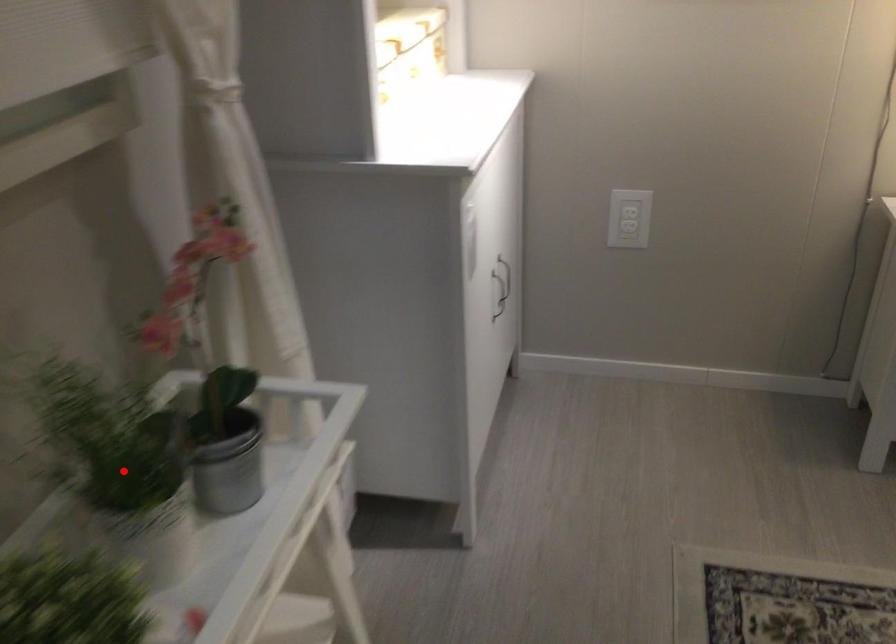
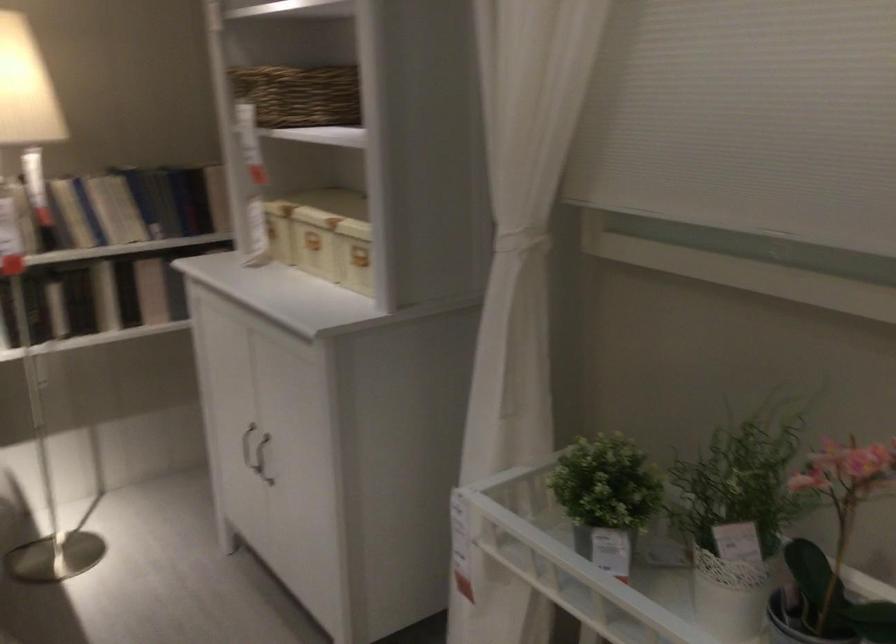
In the second image, find the point that corresponds to the highlighted location in the first image.

(735, 518)